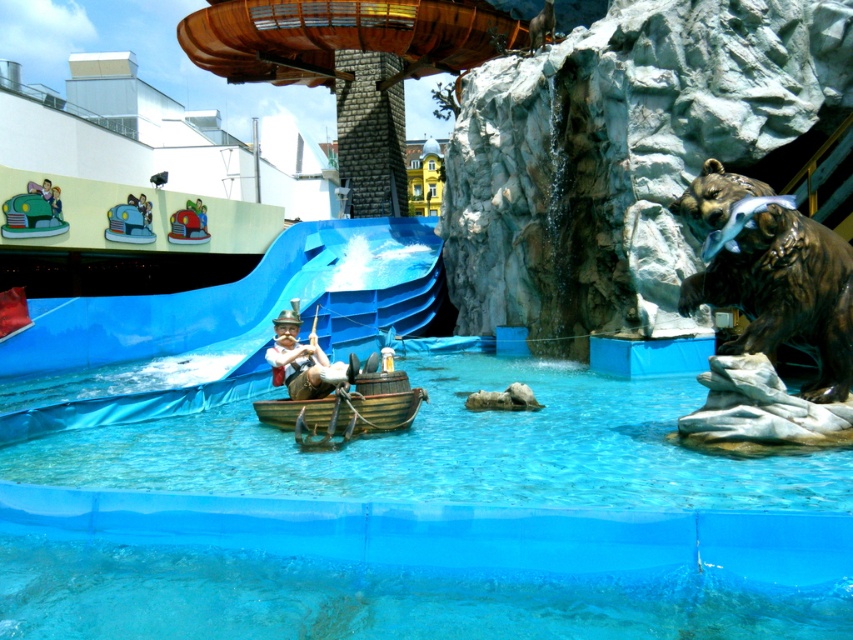
You are a visitor at the amusement park and want to take a photo with the bronze bear at right and the wooden raft at center. Since you want both objects to appear balanced in the frame, which object should you move closer to the camera?

To balance the composition, you should move the wooden raft at center closer to the camera because the bronze bear at right is already larger in size, and bringing the smaller wooden raft at center forward would make them appear more equal in size in the photo.

You are standing at the point marked by coordinates point [343,412]. What object are you standing on?

You are standing on the wooden raft at center.